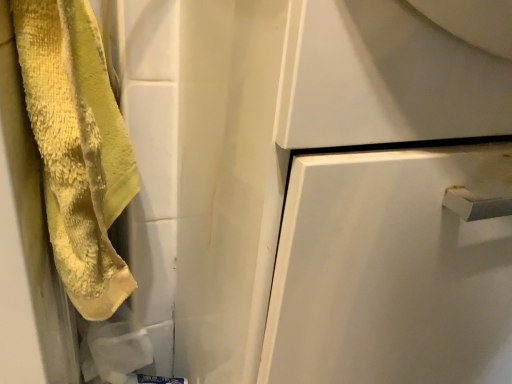
What is the approximate width of white glossy cabinet door at upper center?

It is 16.36 inches.

The image size is (512, 384). What do you see at coordinates (385, 78) in the screenshot?
I see `white glossy cabinet door at upper center` at bounding box center [385, 78].

Where is `white glossy cabinet door at upper center`? white glossy cabinet door at upper center is located at coordinates (385, 78).

Where is `white glossy cabinet door at upper center`? The width and height of the screenshot is (512, 384). white glossy cabinet door at upper center is located at coordinates (385, 78).